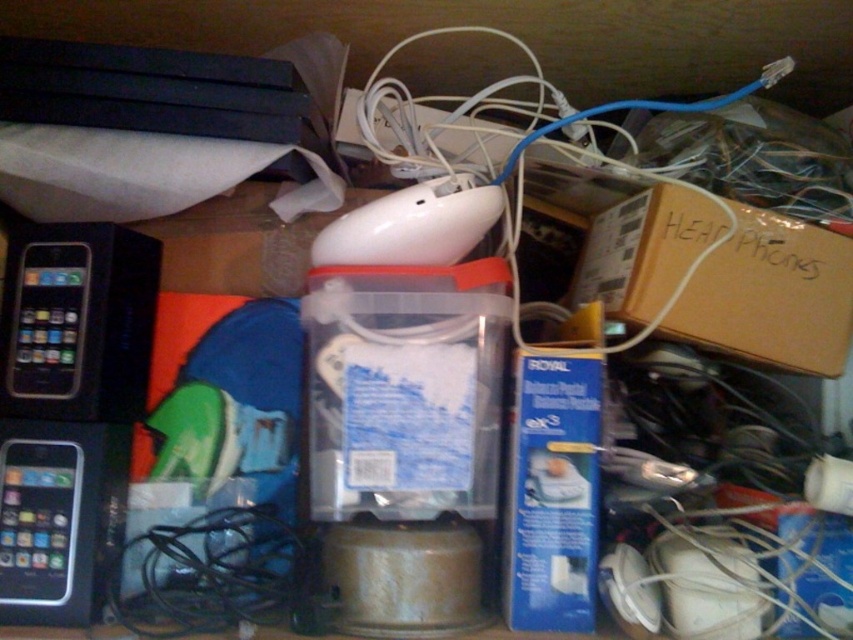
Does point (51, 264) come closer to viewer compared to point (74, 444)?

No, it is behind (74, 444).

At what (x,y) coordinates should I click in order to perform the action: click on black glossy iphone at left. Please return your answer as a coordinate pair (x, y). This screenshot has width=853, height=640. Looking at the image, I should click on (77, 321).

Who is more forward, (653, 323) or (70, 557)?

Point (70, 557) is more forward.

Who is more distant from viewer, (x=543, y=92) or (x=38, y=554)?

The point (x=543, y=92) is behind.

Between point (432, 35) and point (74, 552), which one is positioned behind?

Point (432, 35)

Identify the location of blue cable at center. [527, 145].

Identify the location of black glossy iphone at left. (77, 321).

Does black glossy iphone at left have a lesser height compared to black glossy ipod at left?

No, black glossy iphone at left is not shorter than black glossy ipod at left.

This screenshot has height=640, width=853. What are the coordinates of `black glossy iphone at left` in the screenshot? It's located at (77, 321).